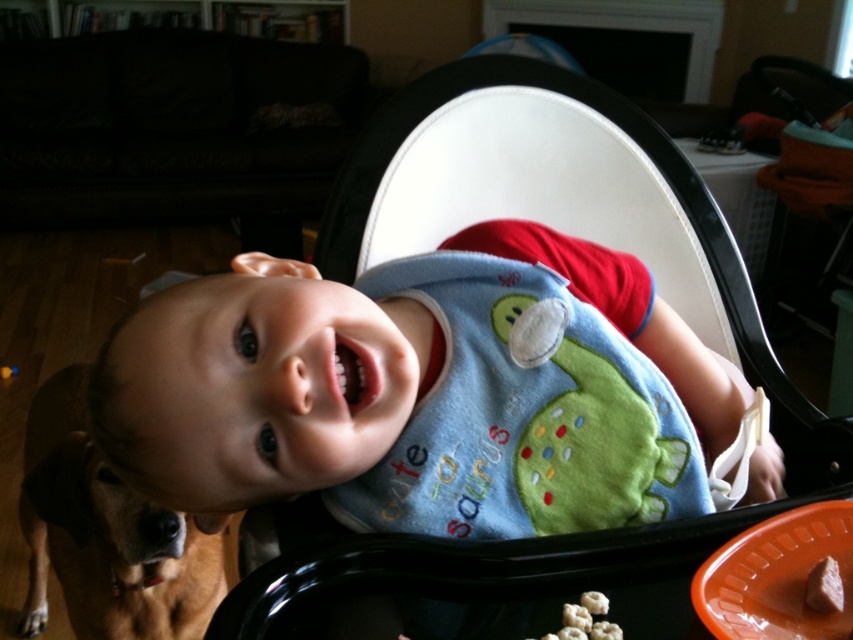
Which is more to the right, white fluffy popcorn at lower center or brown matte cookie at lower right?

From the viewer's perspective, brown matte cookie at lower right appears more on the right side.

Identify the location of white fluffy popcorn at lower center. (585, 620).

Locate an element on the screen. This screenshot has width=853, height=640. white fluffy popcorn at lower center is located at coordinates (585, 620).

Locate an element on the screen. white fluffy popcorn at lower center is located at coordinates (585, 620).

Which of these two, cute fabric bib at center or black plastic highchair at center, stands shorter?

With less height is cute fabric bib at center.

Does cute fabric bib at center have a lesser width compared to black plastic highchair at center?

Indeed, cute fabric bib at center has a lesser width compared to black plastic highchair at center.

Find the location of a particular element. This screenshot has width=853, height=640. cute fabric bib at center is located at coordinates (422, 392).

Where is `cute fabric bib at center`? cute fabric bib at center is located at coordinates (422, 392).

Who is higher up, cute fabric bib at center or brown matte cookie at lower right?

cute fabric bib at center

Can you confirm if cute fabric bib at center is shorter than brown matte cookie at lower right?

No.

Is point (451, 435) farther from camera compared to point (828, 570)?

Yes, point (451, 435) is farther from viewer.

I want to click on cute fabric bib at center, so pyautogui.click(x=422, y=392).